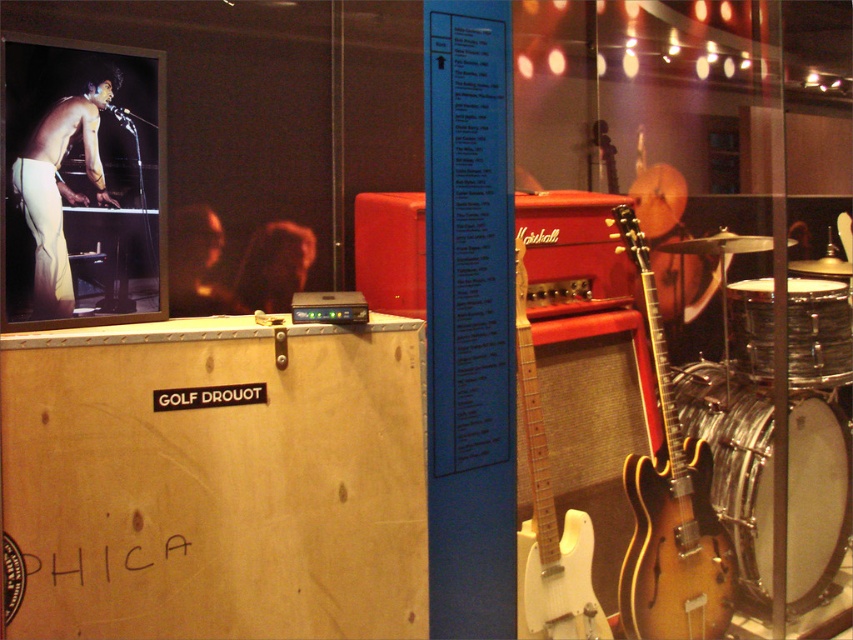
Question: Which object is the farthest from the matte white pants at left?

Choices:
 (A) white matte electric guitar at center
 (B) white drum at lower right
 (C) shiny silver drum at right
 (D) sunburst wood electric guitar at right

Answer: (B)

Question: Which object is farther from the camera taking this photo?

Choices:
 (A) matte white pants at left
 (B) shiny silver drum at right
 (C) white drum at lower right
 (D) white matte electric guitar at center

Answer: (C)

Question: Considering the relative positions of sunburst wood electric guitar at right and shiny silver drum at right in the image provided, where is sunburst wood electric guitar at right located with respect to shiny silver drum at right?

Choices:
 (A) right
 (B) left

Answer: (B)

Question: Is sunburst wood electric guitar at right in front of shiny silver drum at right?

Choices:
 (A) no
 (B) yes

Answer: (B)

Question: Can you confirm if white drum at lower right is positioned above matte white pants at left?

Choices:
 (A) yes
 (B) no

Answer: (B)

Question: Among these points, which one is nearest to the camera?

Choices:
 (A) (668, 474)
 (B) (753, 525)
 (C) (62, 260)
 (D) (758, 300)

Answer: (C)